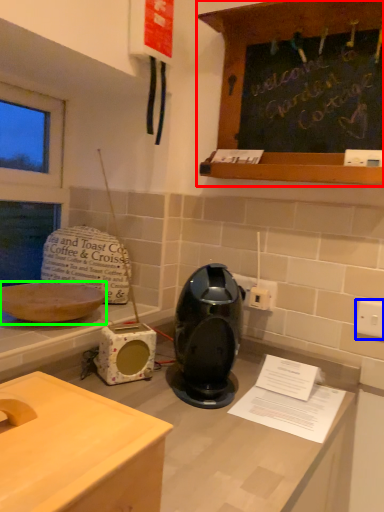
Question: Based on their relative distances, which object is nearer to cabinetry (highlighted by a red box)? Choose from electric outlet (highlighted by a blue box) and kitchen appliance (highlighted by a green box).

Choices:
 (A) electric outlet
 (B) kitchen appliance

Answer: (A)